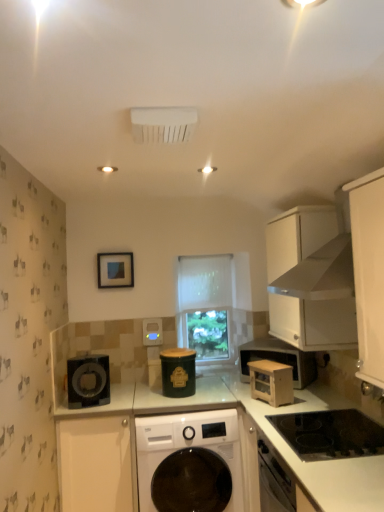
This screenshot has width=384, height=512. What do you see at coordinates (205, 305) in the screenshot?
I see `white sheer at center` at bounding box center [205, 305].

Measure the distance between white sheer at center and camera.

They are 3.20 meters apart.

This screenshot has height=512, width=384. What do you see at coordinates (271, 382) in the screenshot? I see `wooden microwave at center-right` at bounding box center [271, 382].

Where is `matte plastic container at center, which ranks as the 2th appliance in left-to-right order`? matte plastic container at center, which ranks as the 2th appliance in left-to-right order is located at coordinates (152, 332).

From a real-world perspective, is white matte cabinet at upper right, placed as the 2th cabinetry when sorted from bottom to top, located higher than white glossy countertop at lower right?

Yes, from a real-world perspective, white matte cabinet at upper right, placed as the 2th cabinetry when sorted from bottom to top, is above white glossy countertop at lower right.

How many degrees apart are the facing directions of white matte cabinet at upper right, which is the second cabinetry in left-to-right order, and white glossy countertop at lower right?

They differ by 0.521 degrees in their facing directions.

Considering their positions, is white matte cabinet at upper right, acting as the 1th cabinetry starting from the top, located in front of or behind white glossy countertop at lower right?

white matte cabinet at upper right, acting as the 1th cabinetry starting from the top, is behind white glossy countertop at lower right.

This screenshot has height=512, width=384. In order to click on cabinetry on the right side of white glossy countertop at lower right in this screenshot , I will do `click(311, 280)`.

Is point (160, 323) closer or farther from the camera than point (150, 132)?

Point (160, 323) is positioned farther from the camera compared to point (150, 132).

Is matte plastic container at center, which ranks as the 2th appliance in left-to-right order, oriented away from white plastic air conditioning unit at upper center?

No, white plastic air conditioning unit at upper center is not at the back of matte plastic container at center, which ranks as the 2th appliance in left-to-right order.

Is matte plastic container at center, acting as the 3th appliance starting from the front, to the right of white plastic air conditioning unit at upper center from the viewer's perspective?

No, matte plastic container at center, acting as the 3th appliance starting from the front, is not to the right of white plastic air conditioning unit at upper center.

Is matte plastic container at center, which ranks as the 2th appliance in left-to-right order, smaller than white plastic air conditioning unit at upper center?

Correct, matte plastic container at center, which ranks as the 2th appliance in left-to-right order, occupies less space than white plastic air conditioning unit at upper center.

Looking at the image, does green matte canister at center, the 2th appliance when ordered from front to back, seem bigger or smaller compared to white matte cabinet at lower left, acting as the 1th cabinetry starting from the bottom?

In the image, green matte canister at center, the 2th appliance when ordered from front to back, appears to be smaller than white matte cabinet at lower left, acting as the 1th cabinetry starting from the bottom.

From the image's perspective, between green matte canister at center, which ranks as the first appliance in right-to-left order, and white matte cabinet at lower left, the 1th cabinetry positioned from the left, who is located below?

white matte cabinet at lower left, the 1th cabinetry positioned from the left, appears lower in the image.

Which of these two, white matte cabinet at upper right, which is the second cabinetry in left-to-right order, or green matte canister at center, which is counted as the third appliance, starting from the left, is smaller?

With smaller size is green matte canister at center, which is counted as the third appliance, starting from the left.

Can we say white matte cabinet at upper right, acting as the 1th cabinetry starting from the top, lies outside green matte canister at center, which is counted as the third appliance, starting from the left?

Absolutely, white matte cabinet at upper right, acting as the 1th cabinetry starting from the top, is external to green matte canister at center, which is counted as the third appliance, starting from the left.

Between point (309, 316) and point (192, 354), which one is positioned in front?

The point (309, 316) is more forward.

Is white matte cabinet at upper right, acting as the 1th cabinetry starting from the top, facing towards green matte canister at center, which appears as the second appliance when viewed from the back?

Yes, white matte cabinet at upper right, acting as the 1th cabinetry starting from the top, faces towards green matte canister at center, which appears as the second appliance when viewed from the back.

Could you tell me if matte plastic container at center, the 2th appliance from the right, is facing wooden stool at lower right?

No, matte plastic container at center, the 2th appliance from the right, is not aimed at wooden stool at lower right.

From the image's perspective, is matte plastic container at center, which ranks as the 1th appliance in back-to-front order, located beneath wooden stool at lower right?

No, from the image's perspective, matte plastic container at center, which ranks as the 1th appliance in back-to-front order, is not below wooden stool at lower right.

You are a GUI agent. You are given a task and a screenshot of the screen. Output one action in this format:
    pyautogui.click(x=<x>, y=<y>)
    Task: Click on the appliance located above the wooden stool at lower right (from the image's perspective)
    Image resolution: width=384 pixels, height=512 pixels.
    Given the screenshot: What is the action you would take?
    pos(152,332)

From a real-world perspective, which is physically above, matte plastic container at center, acting as the 3th appliance starting from the front, or wooden stool at lower right?

matte plastic container at center, acting as the 3th appliance starting from the front.

Which object is further away from the camera, white sheer at center or white glossy washing machine at center?

white sheer at center is further from the camera.

What's the angular difference between white sheer at center and white glossy washing machine at center's facing directions?

The angle between the facing direction of white sheer at center and the facing direction of white glossy washing machine at center is 1.82 degrees.

Is white sheer at center positioned beyond the bounds of white glossy washing machine at center?

Yes, white sheer at center is located beyond the bounds of white glossy washing machine at center.

Which is farther from the camera, (178, 292) or (153, 471)?

The point (178, 292) is farther.

Is black glass cooktop at lower right to the right of green matte canister at center, which appears as the second appliance when viewed from the back, from the viewer's perspective?

Yes, black glass cooktop at lower right is to the right of green matte canister at center, which appears as the second appliance when viewed from the back.

How many degrees apart are the facing directions of black glass cooktop at lower right and green matte canister at center, which ranks as the first appliance in right-to-left order?

The facing directions of black glass cooktop at lower right and green matte canister at center, which ranks as the first appliance in right-to-left order, are 89.1 degrees apart.

Is black glass cooktop at lower right positioned before green matte canister at center, which appears as the second appliance when viewed from the back?

Yes, it is in front of green matte canister at center, which appears as the second appliance when viewed from the back.

In the scene shown: From the image's perspective, is black glass cooktop at lower right on top of green matte canister at center, which ranks as the first appliance in right-to-left order?

No.

The height and width of the screenshot is (512, 384). What are the coordinates of `the 2nd cabinetry located above the white glossy countertop at lower right (from a real-world perspective)` in the screenshot? It's located at [311, 280].

The image size is (384, 512). What are the coordinates of `the 1st appliance to the left when counting from the white plastic air conditioning unit at upper center` in the screenshot? It's located at (152, 332).

Based on their spatial positions, is green matte canister at center, which is counted as the third appliance, starting from the left, or white glossy countertop at lower right further from wooden stool at lower right?

Among the two, green matte canister at center, which is counted as the third appliance, starting from the left, is located further to wooden stool at lower right.

From the image, which object appears to be farther from white matte cabinet at lower left, acting as the 1th cabinetry starting from the bottom, matte plastic container at center, which ranks as the 2th appliance in left-to-right order, or matte blue picture frame at upper center?

Based on the image, matte blue picture frame at upper center appears to be further to white matte cabinet at lower left, acting as the 1th cabinetry starting from the bottom.

Based on their spatial positions, is wooden stool at lower right or white glossy washing machine at center closer to white plastic air conditioning unit at upper center?

Among the two, white glossy washing machine at center is located nearer to white plastic air conditioning unit at upper center.

Estimate the real-world distances between objects in this image. Which object is closer to green matte canister at center, which appears as the second appliance when viewed from the back, white sheer at center or matte blue picture frame at upper center?

white sheer at center is closer to green matte canister at center, which appears as the second appliance when viewed from the back.

Which object lies nearer to the anchor point wooden stool at lower right, white glossy washing machine at center or white plastic air conditioning unit at upper center?

white glossy washing machine at center.

Which object lies further to the anchor point white glossy countertop at lower right, green matte canister at center, the 2th appliance when ordered from front to back, or white sheer at center?

white sheer at center lies further to white glossy countertop at lower right than the other object.

Which object lies nearer to the anchor point white plastic air conditioning unit at upper center, green matte canister at center, which appears as the second appliance when viewed from the back, or matte blue picture frame at upper center?

green matte canister at center, which appears as the second appliance when viewed from the back, is positioned closer to the anchor white plastic air conditioning unit at upper center.

Looking at the image, which one is located closer to white sheer at center, black glass cooktop at lower right or white plastic air conditioning unit at upper center?

black glass cooktop at lower right is closer to white sheer at center.

Where is `microwave oven situated between matte blue picture frame at upper center and white glossy countertop at lower right from left to right`? This screenshot has width=384, height=512. microwave oven situated between matte blue picture frame at upper center and white glossy countertop at lower right from left to right is located at coordinates (271, 382).

Where is `washing machine between black glass cooktop at lower right and white sheer at center from front to back`? This screenshot has height=512, width=384. washing machine between black glass cooktop at lower right and white sheer at center from front to back is located at coordinates (188, 447).

Locate an element on the screen. The image size is (384, 512). cabinetry between matte black speaker at lower left, positioned as the 1th appliance in left-to-right order, and black glass cooktop at lower right is located at coordinates (95, 463).

You are a GUI agent. You are given a task and a screenshot of the screen. Output one action in this format:
    pyautogui.click(x=<x>, y=<y>)
    Task: Click on the microwave oven positioned between black glass cooktop at lower right and white sheer at center from near to far
    
    Given the screenshot: What is the action you would take?
    [271, 382]